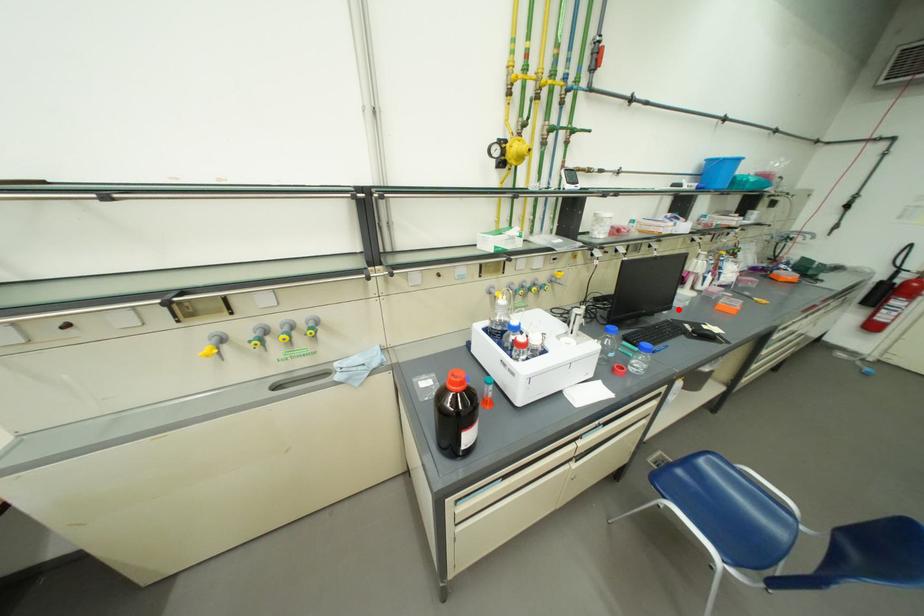
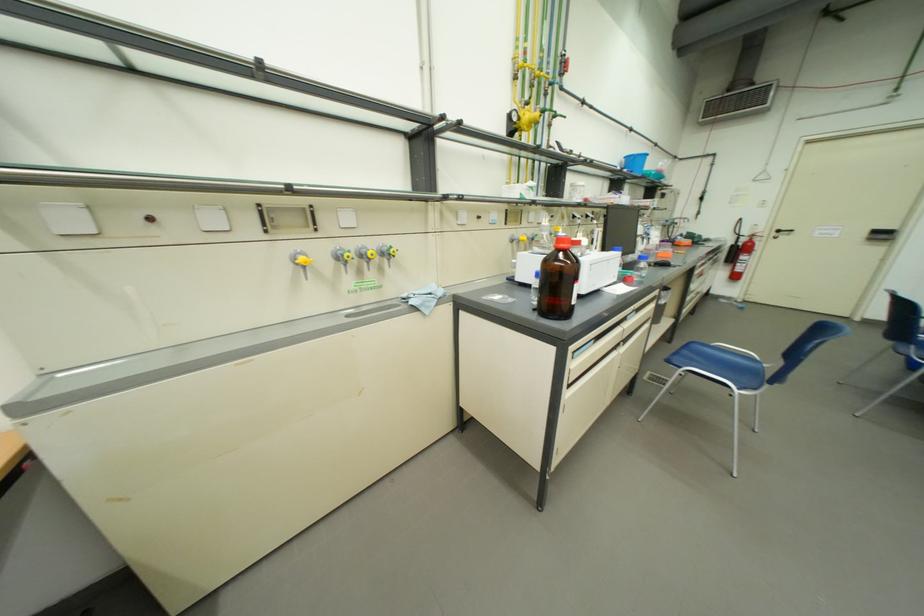
Find the pixel in the second image that matches the highlighted location in the first image.

(642, 254)